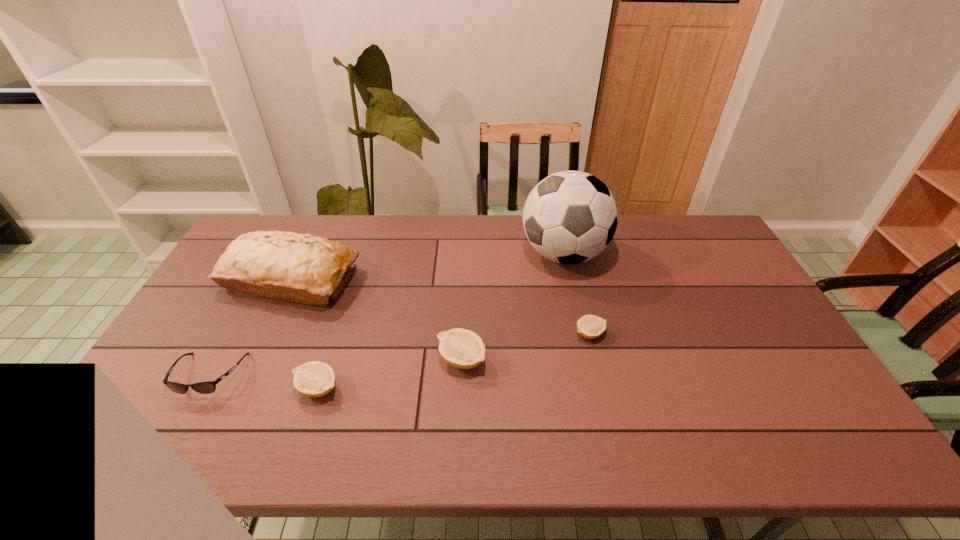
You are a GUI agent. You are given a task and a screenshot of the screen. Output one action in this format:
    pyautogui.click(x=<x>, y=<y>)
    Task: Click on the second tallest lemon
    Image resolution: width=960 pixels, height=540 pixels.
    Given the screenshot: What is the action you would take?
    pyautogui.click(x=313, y=379)

Identify the location of the tallest lemon. This screenshot has width=960, height=540. (461, 348).

Find the location of `the third object from right to left`. the third object from right to left is located at coordinates (461, 348).

Image resolution: width=960 pixels, height=540 pixels. Find the location of `the rightmost lemon`. the rightmost lemon is located at coordinates (589, 326).

At what (x,y) coordinates should I click in order to perform the action: click on the shortest object. Please return your answer as a coordinate pair (x, y). This screenshot has width=960, height=540. Looking at the image, I should click on (x=589, y=326).

Identify the location of the tallest object. Image resolution: width=960 pixels, height=540 pixels. point(569,217).

At what (x,y) coordinates should I click in order to perform the action: click on the second tallest object. Please return your answer as a coordinate pair (x, y). Looking at the image, I should click on (288, 266).

The height and width of the screenshot is (540, 960). I want to click on sunglasses, so click(208, 387).

The width and height of the screenshot is (960, 540). What are the coordinates of `free space located on the right of the leftmost lemon` in the screenshot? It's located at (392, 388).

At what (x,y) coordinates should I click in order to perform the action: click on free space located 0.390m on the back of the second lemon from right to left. Please return your answer as a coordinate pair (x, y). This screenshot has width=960, height=540. Looking at the image, I should click on (466, 255).